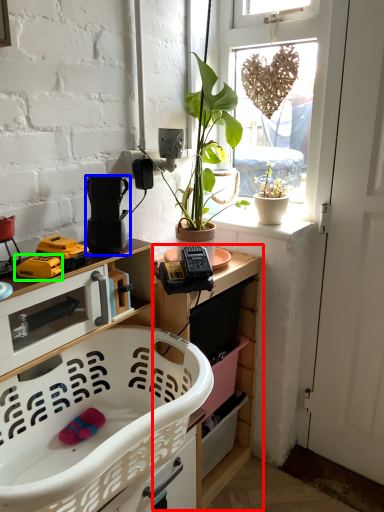
Question: Which object is positioned farthest from shelf (highlighted by a red box)? Select from appliance (highlighted by a blue box) and toy (highlighted by a green box).

Choices:
 (A) appliance
 (B) toy

Answer: (B)